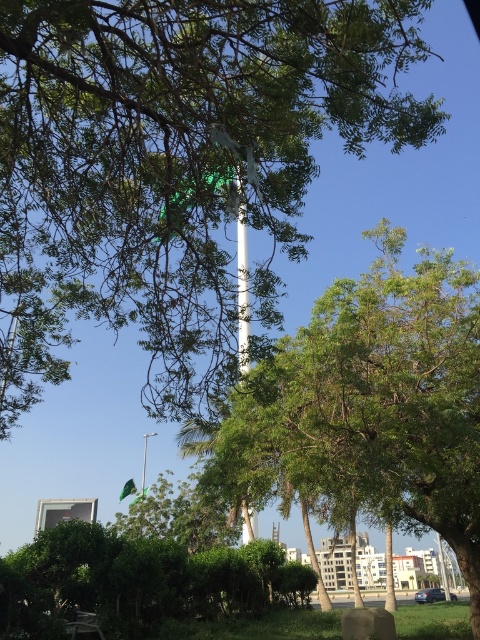
Question: Does white glossy pole at center appear on the left side of green fabric flag at center?

Choices:
 (A) no
 (B) yes

Answer: (A)

Question: Which is nearer to the green leafy tree at center?

Choices:
 (A) white glossy pole at center
 (B) green leafy tree at upper center
 (C) green fabric flag at center

Answer: (B)

Question: Which object is farther from the camera taking this photo?

Choices:
 (A) white glossy pole at center
 (B) green leafy tree at upper center
 (C) green leafy tree at center

Answer: (C)

Question: Does green leafy tree at upper center appear on the left side of green fabric flag at center?

Choices:
 (A) no
 (B) yes

Answer: (A)

Question: Which point is farther from the camera taking this photo?

Choices:
 (A) (360, 76)
 (B) (468, 516)
 (C) (144, 461)

Answer: (C)

Question: Can you confirm if green leafy tree at upper center is positioned above green fabric flag at center?

Choices:
 (A) yes
 (B) no

Answer: (A)